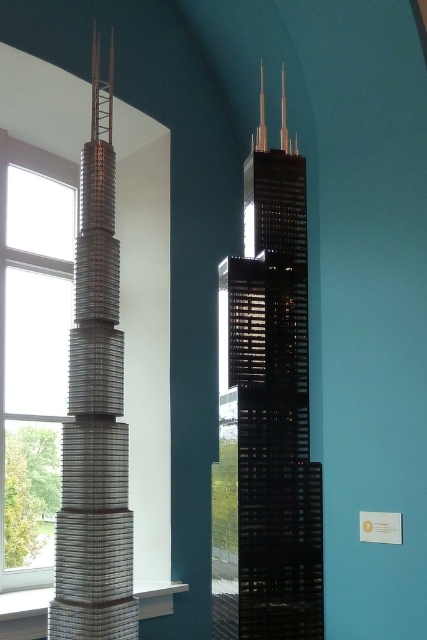
Does black glass tower at center come behind metallic silver tower at left?

No, it is in front of metallic silver tower at left.

Is point (301, 163) more distant than point (76, 280)?

No, it is in front of (76, 280).

Between point (265, 588) and point (113, 51), which one is positioned behind?

The point (113, 51) is behind.

This screenshot has height=640, width=427. Identify the location of black glass tower at center. (266, 413).